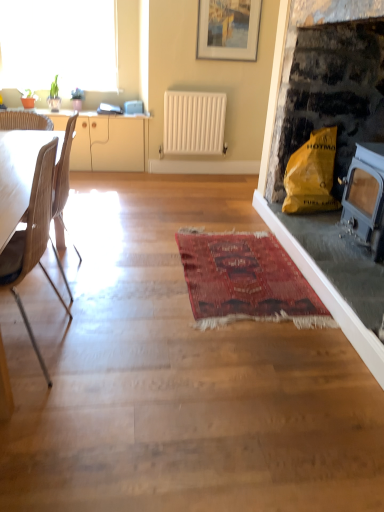
Question: Is red woven rug at center closer to the viewer compared to wooden chair at left, which is the 2th chair from back to front?

Choices:
 (A) no
 (B) yes

Answer: (A)

Question: Is wooden chair at left, which is the 2th chair from back to front, located within red woven rug at center?

Choices:
 (A) no
 (B) yes

Answer: (A)

Question: Is red woven rug at center at the right side of wooden chair at left, which ranks as the first chair in front-to-back order?

Choices:
 (A) no
 (B) yes

Answer: (B)

Question: Is red woven rug at center outside of wooden chair at left, which is the 2th chair from back to front?

Choices:
 (A) yes
 (B) no

Answer: (A)

Question: Are red woven rug at center and wooden chair at left, which ranks as the first chair in front-to-back order, beside each other?

Choices:
 (A) no
 (B) yes

Answer: (A)

Question: From the image's perspective, is red woven rug at center above wooden chair at left, which ranks as the first chair in front-to-back order?

Choices:
 (A) no
 (B) yes

Answer: (A)

Question: Is beige wood cabinet at left at the back of yellow paper bag at right?

Choices:
 (A) yes
 (B) no

Answer: (B)

Question: Is yellow paper bag at right not inside beige wood cabinet at left?

Choices:
 (A) yes
 (B) no

Answer: (A)

Question: Is yellow paper bag at right positioned behind beige wood cabinet at left?

Choices:
 (A) no
 (B) yes

Answer: (A)

Question: Does yellow paper bag at right have a greater height compared to beige wood cabinet at left?

Choices:
 (A) no
 (B) yes

Answer: (B)

Question: From the image's perspective, is yellow paper bag at right under beige wood cabinet at left?

Choices:
 (A) no
 (B) yes

Answer: (B)

Question: From the image's perspective, does yellow paper bag at right appear higher than beige wood cabinet at left?

Choices:
 (A) yes
 (B) no

Answer: (B)

Question: Is transparent glass window at upper left located outside light brown wood chair at left, placed as the first chair when sorted from back to front?

Choices:
 (A) no
 (B) yes

Answer: (B)